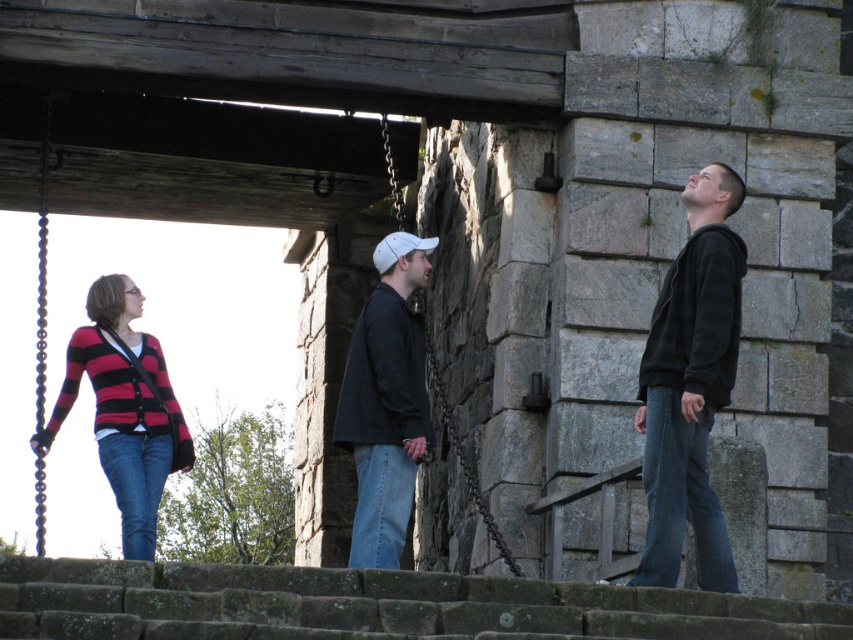
You are a photographer trying to capture the striped knit cardigan at left and denim at center in the same frame. Which object should you position closer to the camera to ensure both are in focus?

The striped knit cardigan at left is positioned on the left side of denim at center. To ensure both are in focus, you should position the camera so that both are at a similar distance from the lens. Since they are already aligned horizontally, adjusting the focus to a midpoint between them or using a smaller aperture for a deeper depth of field would be more effective than moving either object closer.

Looking at this image, you are a photographer trying to capture both the dark gray hoodie at right and the denim at left in a single frame. Based on their sizes in the image, which clothing item should you focus on to ensure both are visible without cropping?

The dark gray hoodie at right occupies less space than denim at left, so focusing on the denim at left would allow both items to fit within the frame since it is larger and might help balance the composition.